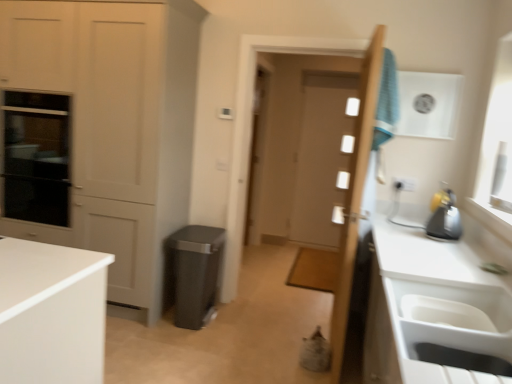
Measure the distance between white plastic sink at lower right and camera.

white plastic sink at lower right is 4.44 feet from camera.

Find the location of a particular element. clear glass screen door at center is located at coordinates (257, 156).

Find the location of a particular element. The width and height of the screenshot is (512, 384). white glossy door at center, the second door when ordered from front to back is located at coordinates (322, 163).

Measure the distance between black glass oven at left and camera.

black glass oven at left is 2.85 meters from camera.

Find the location of a particular element. white plastic sink at lower right is located at coordinates (437, 333).

Consider the image. Which is in front, black glass oven at left or blue fabric laundry at upper right?

Positioned in front is blue fabric laundry at upper right.

Considering the relative sizes of black glass oven at left and blue fabric laundry at upper right in the image provided, is black glass oven at left taller than blue fabric laundry at upper right?

Yes.

From a real-world perspective, which object rests below the other?

From a 3D spatial view, black glass oven at left is below.

In terms of size, does black glass oven at left appear bigger or smaller than blue fabric laundry at upper right?

black glass oven at left is bigger than blue fabric laundry at upper right.

Who is taller, blue fabric laundry at upper right or matte plastic trash can at center?

matte plastic trash can at center is taller.

Locate an element on the screen. laundry that is on the right side of matte plastic trash can at center is located at coordinates (386, 102).

Considering the relative positions of blue fabric laundry at upper right and matte plastic trash can at center in the image provided, is blue fabric laundry at upper right behind matte plastic trash can at center?

That is False.

Considering the relative sizes of blue fabric laundry at upper right and matte white cabinet at left in the image provided, is blue fabric laundry at upper right smaller than matte white cabinet at left?

Yes, blue fabric laundry at upper right is smaller than matte white cabinet at left.

Is point (395, 77) farther from camera compared to point (155, 181)?

No, (395, 77) is in front of (155, 181).

Considering the relative sizes of blue fabric laundry at upper right and matte white cabinet at left in the image provided, is blue fabric laundry at upper right wider than matte white cabinet at left?

No, blue fabric laundry at upper right is not wider than matte white cabinet at left.

Based on the photo, from the image's perspective, which is below, blue fabric laundry at upper right or matte white cabinet at left?

matte white cabinet at left.

Is black glass oven at left facing away from matte white cabinet at left?

That's right, black glass oven at left is facing away from matte white cabinet at left.

From a real-world perspective, who is located lower, black glass oven at left or matte white cabinet at left?

black glass oven at left, from a real-world perspective.

Is black glass oven at left outside of matte white cabinet at left?

No, black glass oven at left is not entirely external to matte white cabinet at left.

From the image's perspective, is wooden door at center, arranged as the 1th door when viewed from the front, under blue fabric laundry at upper right?

Yes, from the image's perspective, wooden door at center, arranged as the 1th door when viewed from the front, is below blue fabric laundry at upper right.

How different are the orientations of wooden door at center, arranged as the 1th door when viewed from the front, and blue fabric laundry at upper right in degrees?

The angle between the facing direction of wooden door at center, arranged as the 1th door when viewed from the front, and the facing direction of blue fabric laundry at upper right is 180 degrees.

Can you confirm if wooden door at center, the 2th door in the back-to-front sequence, is positioned to the right of blue fabric laundry at upper right?

Incorrect, wooden door at center, the 2th door in the back-to-front sequence, is not on the right side of blue fabric laundry at upper right.

Do you think wooden door at center, arranged as the 1th door when viewed from the front, is within blue fabric laundry at upper right, or outside of it?

The correct answer is: outside.

How different are the orientations of matte plastic trash can at center and clear glass screen door at center in degrees?

98.7 degrees separate the facing orientations of matte plastic trash can at center and clear glass screen door at center.

Find the location of a particular element. appliance on the left of clear glass screen door at center is located at coordinates (195, 272).

Is matte plastic trash can at center facing away from clear glass screen door at center?

No.

Between matte plastic trash can at center and clear glass screen door at center, which one appears on the right side from the viewer's perspective?

clear glass screen door at center is more to the right.

Considering the relative sizes of white plastic sink at lower right and white glossy door at center, the second door when ordered from front to back, in the image provided, is white plastic sink at lower right shorter than white glossy door at center, the second door when ordered from front to back,?

Indeed, white plastic sink at lower right has a lesser height compared to white glossy door at center, the second door when ordered from front to back.

Can you tell me how much white plastic sink at lower right and white glossy door at center, the second door when ordered from front to back, differ in facing direction?

The angular difference between white plastic sink at lower right and white glossy door at center, the second door when ordered from front to back, is 91 degrees.

From a real-world perspective, between white plastic sink at lower right and white glossy door at center, the second door when ordered from front to back, who is vertically lower?

white plastic sink at lower right, from a real-world perspective.

Based on the photo, can you confirm if white plastic sink at lower right is positioned to the right of white glossy door at center, which ranks as the first door in back-to-front order?

No.

Locate an element on the screen. oven on the left of blue fabric laundry at upper right is located at coordinates (36, 157).

Image resolution: width=512 pixels, height=384 pixels. In the image, there is a blue fabric laundry at upper right. In order to click on appliance below it (from a real-world perspective) in this screenshot , I will do `click(195, 272)`.

Estimate the real-world distances between objects in this image. Which object is further from matte plastic trash can at center, black glass oven at left or white plastic sink at lower right?

The object further to matte plastic trash can at center is white plastic sink at lower right.

From the image, which object appears to be farther from blue fabric laundry at upper right, white glossy door at center, which ranks as the first door in back-to-front order, or matte plastic trash can at center?

white glossy door at center, which ranks as the first door in back-to-front order, is further to blue fabric laundry at upper right.

Which object lies further to the anchor point blue fabric laundry at upper right, matte plastic trash can at center or matte white cabinet at left?

Based on the image, matte white cabinet at left appears to be further to blue fabric laundry at upper right.

Consider the image. Considering their positions, is wooden door at center, arranged as the 1th door when viewed from the front, positioned further to black glass oven at left than matte white cabinet at left?

wooden door at center, arranged as the 1th door when viewed from the front, is further to black glass oven at left.

From the image, which object appears to be farther from wooden door at center, the 2th door in the back-to-front sequence, matte plastic trash can at center or white plastic sink at lower right?

Based on the image, matte plastic trash can at center appears to be further to wooden door at center, the 2th door in the back-to-front sequence.

In the scene shown: Which object lies nearer to the anchor point clear glass screen door at center, white plastic sink at lower right or matte white cabinet at left?

The object closer to clear glass screen door at center is matte white cabinet at left.

In the scene shown: Considering their positions, is white plastic sink at lower right positioned closer to white glossy door at center, the second door when ordered from front to back, than wooden door at center, the 2th door in the back-to-front sequence?

wooden door at center, the 2th door in the back-to-front sequence, lies closer to white glossy door at center, the second door when ordered from front to back, than the other object.

Estimate the real-world distances between objects in this image. Which object is closer to matte white cabinet at left, blue fabric laundry at upper right or white plastic sink at lower right?

blue fabric laundry at upper right.

Where is `appliance situated between black glass oven at left and wooden door at center, the 2th door in the back-to-front sequence, from left to right`? appliance situated between black glass oven at left and wooden door at center, the 2th door in the back-to-front sequence, from left to right is located at coordinates (195, 272).

Where is `oven between wooden door at center, arranged as the 1th door when viewed from the front, and white glossy door at center, which ranks as the first door in back-to-front order, from front to back`? Image resolution: width=512 pixels, height=384 pixels. oven between wooden door at center, arranged as the 1th door when viewed from the front, and white glossy door at center, which ranks as the first door in back-to-front order, from front to back is located at coordinates (36, 157).

You are a GUI agent. You are given a task and a screenshot of the screen. Output one action in this format:
    pyautogui.click(x=<x>, y=<y>)
    Task: Click on the oven between white plastic sink at lower right and clear glass screen door at center from front to back
    Image resolution: width=512 pixels, height=384 pixels.
    Given the screenshot: What is the action you would take?
    pyautogui.click(x=36, y=157)

You are a GUI agent. You are given a task and a screenshot of the screen. Output one action in this format:
    pyautogui.click(x=<x>, y=<y>)
    Task: Click on the door between black glass oven at left and white plastic sink at lower right in the horizontal direction
    
    Given the screenshot: What is the action you would take?
    pyautogui.click(x=355, y=197)